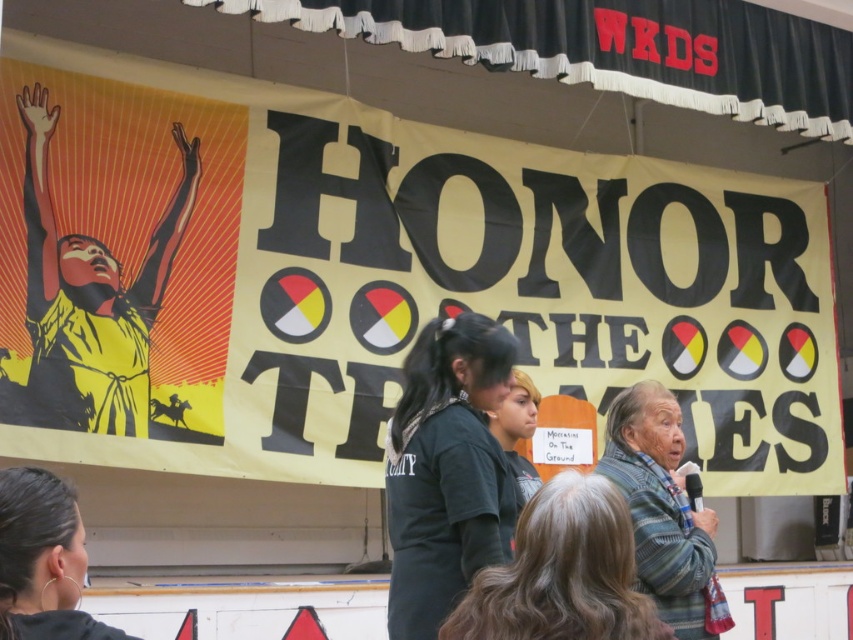
You are an event photographer at the community event. You need to capture a photo of the gray hair at lower center and matte black shirt at lower left. Based on their positions, which object is positioned to the right side of the other?

The gray hair at lower center is to the right of the matte black shirt at lower left.

What is the location of the point at coordinates (x=379, y=280) in the scene?

The point at coordinates (x=379, y=280) is located on the yellow matte poster at center.